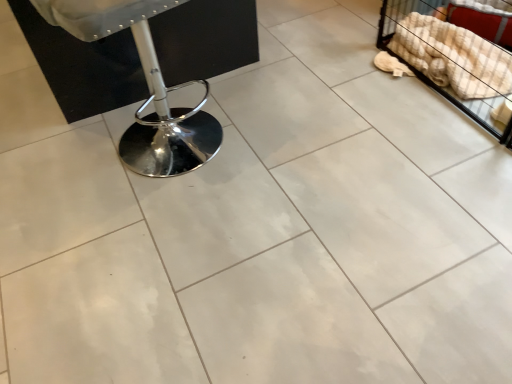
In order to click on vacant space in front of chrome metallic swivel chair at left in this screenshot , I will do [160, 221].